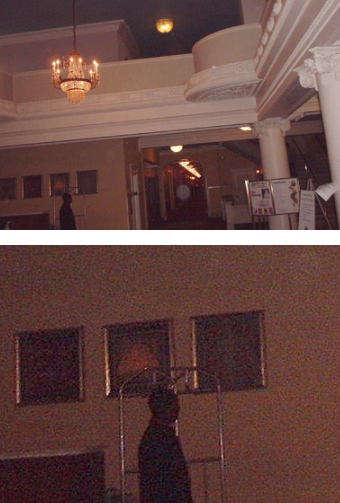
Where is `easel`? This screenshot has height=503, width=340. easel is located at coordinates (311, 181).